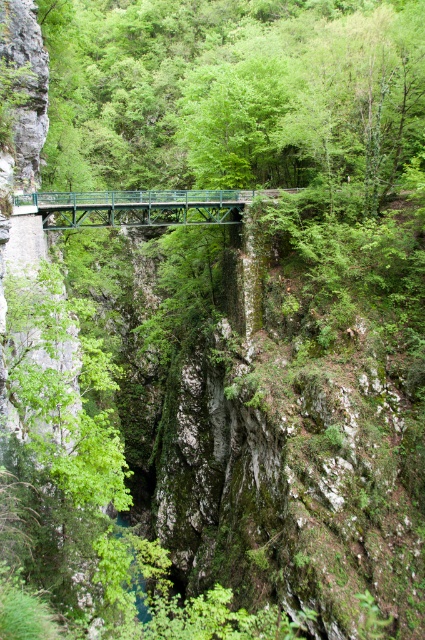
Question: Does green leafy tree at center have a greater width compared to green metallic bridge at center?

Choices:
 (A) yes
 (B) no

Answer: (A)

Question: Can you confirm if green leafy tree at center is smaller than green metallic bridge at center?

Choices:
 (A) yes
 (B) no

Answer: (B)

Question: Among these objects, which one is nearest to the camera?

Choices:
 (A) green leafy tree at center
 (B) green metallic bridge at center

Answer: (B)

Question: Is green leafy tree at center bigger than green metallic bridge at center?

Choices:
 (A) yes
 (B) no

Answer: (A)

Question: Which point is closer to the camera?

Choices:
 (A) green metallic bridge at center
 (B) green leafy tree at center

Answer: (A)